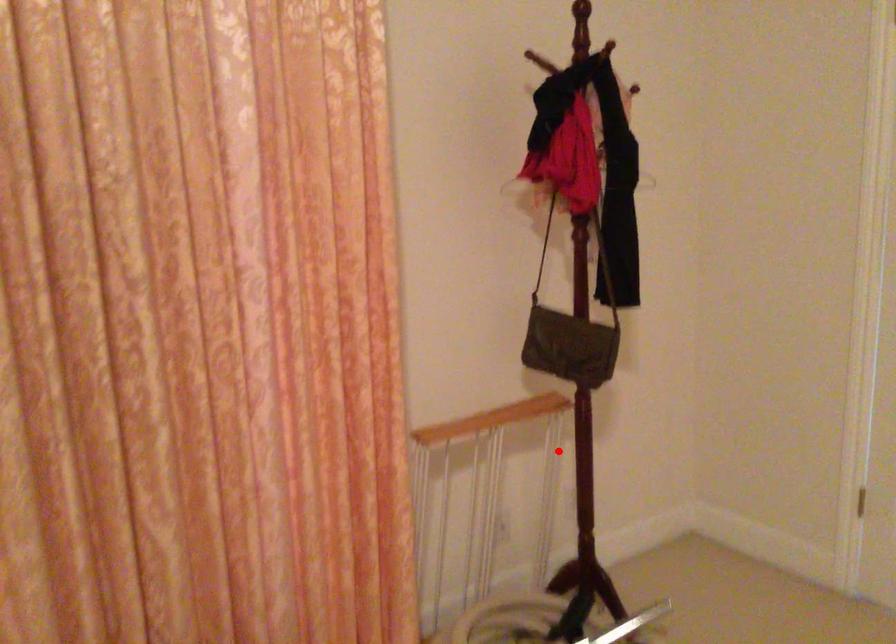
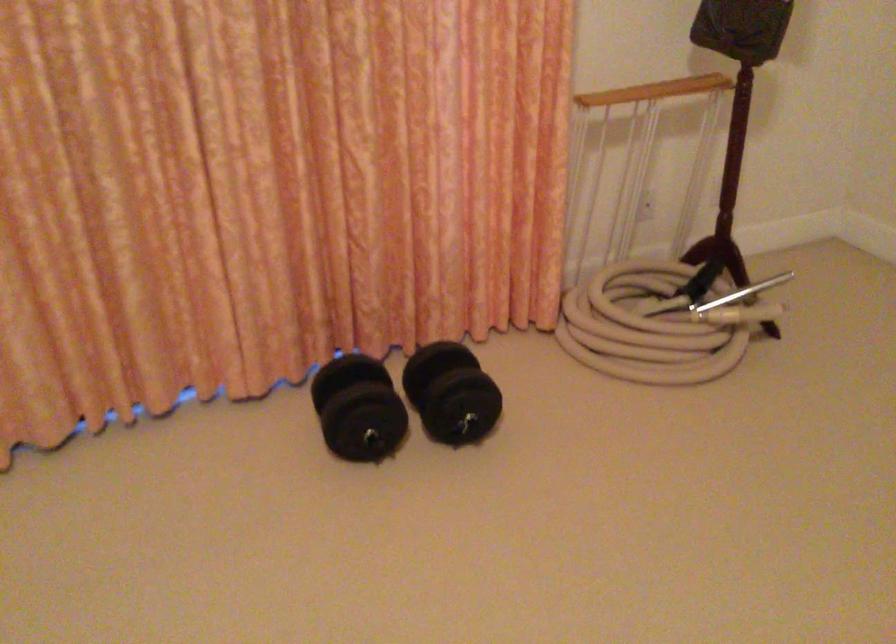
Find the pixel in the second image that matches the highlighted location in the first image.

(719, 137)